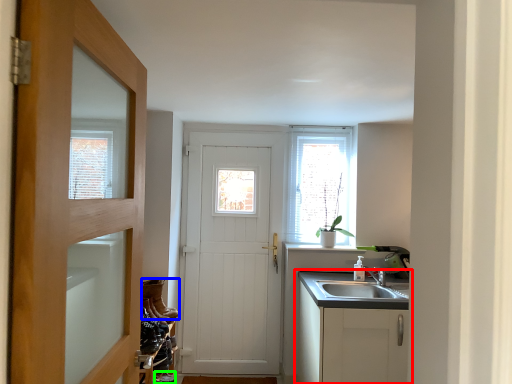
Question: Which object is positioned farthest from cabinetry (highlighted by a red box)? Select from shoe (highlighted by a blue box) and shoe (highlighted by a green box).

Choices:
 (A) shoe
 (B) shoe

Answer: (B)